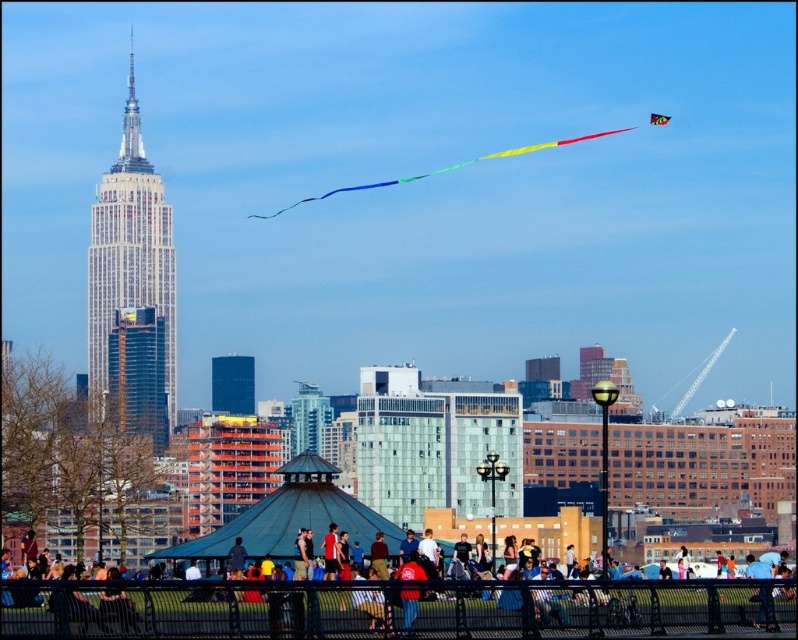
Question: Is multicolored fabric crowd at center wider than multicolored fabric kite at upper right?

Choices:
 (A) yes
 (B) no

Answer: (A)

Question: Which of the following is the farthest from the observer?

Choices:
 (A) (650, 115)
 (B) (550, 147)
 (C) (601, 611)

Answer: (A)

Question: Among these objects, which one is nearest to the camera?

Choices:
 (A) multicolored fabric crowd at center
 (B) rainbow fabric kite at upper center

Answer: (A)

Question: Which point is closer to the camera?

Choices:
 (A) multicolored fabric kite at upper right
 (B) rainbow fabric kite at upper center

Answer: (B)

Question: Does rainbow fabric kite at upper center have a smaller size compared to multicolored fabric kite at upper right?

Choices:
 (A) no
 (B) yes

Answer: (A)

Question: Can you confirm if multicolored fabric crowd at center is bigger than multicolored fabric kite at upper right?

Choices:
 (A) yes
 (B) no

Answer: (A)